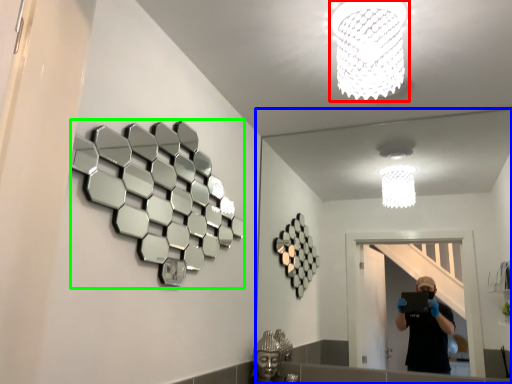
Question: Estimate the real-world distances between objects in this image. Which object is farther from lamp (highlighted by a red box), mirror (highlighted by a blue box) or mirror (highlighted by a green box)?

Choices:
 (A) mirror
 (B) mirror

Answer: (A)